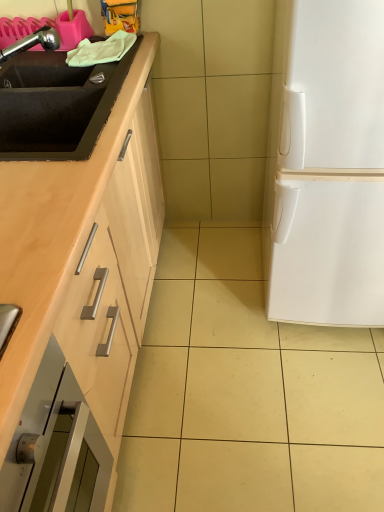
Question: Can you confirm if white matte refrigerator at right is smaller than chrome metallic faucet at upper left, the second sink from the bottom?

Choices:
 (A) yes
 (B) no

Answer: (B)

Question: From the image's perspective, does white matte refrigerator at right appear higher than chrome metallic faucet at upper left, placed as the 1th sink when sorted from top to bottom?

Choices:
 (A) no
 (B) yes

Answer: (A)

Question: Can you confirm if white matte refrigerator at right is thinner than chrome metallic faucet at upper left, the second sink from the bottom?

Choices:
 (A) no
 (B) yes

Answer: (A)

Question: Could you tell me if white matte refrigerator at right is turned towards chrome metallic faucet at upper left, the second sink from the bottom?

Choices:
 (A) no
 (B) yes

Answer: (A)

Question: Does white matte refrigerator at right come behind chrome metallic faucet at upper left, the second sink from the bottom?

Choices:
 (A) yes
 (B) no

Answer: (B)

Question: Does white matte refrigerator at right appear on the left side of chrome metallic faucet at upper left, placed as the 1th sink when sorted from top to bottom?

Choices:
 (A) yes
 (B) no

Answer: (B)

Question: Is black matte sink at left, which appears as the second sink when viewed from the top, at the back of chrome metallic faucet at upper left, placed as the 1th sink when sorted from top to bottom?

Choices:
 (A) no
 (B) yes

Answer: (A)

Question: From a real-world perspective, does chrome metallic faucet at upper left, placed as the 1th sink when sorted from top to bottom, stand above black matte sink at left, which appears as the second sink when viewed from the top?

Choices:
 (A) yes
 (B) no

Answer: (A)

Question: Could you tell me if chrome metallic faucet at upper left, the second sink from the bottom, is turned towards black matte sink at left, which appears as the second sink when viewed from the top?

Choices:
 (A) no
 (B) yes

Answer: (A)

Question: Is chrome metallic faucet at upper left, the second sink from the bottom, positioned far away from black matte sink at left, which appears as the second sink when viewed from the top?

Choices:
 (A) no
 (B) yes

Answer: (A)

Question: Is chrome metallic faucet at upper left, the second sink from the bottom, not inside black matte sink at left, which appears as the second sink when viewed from the top?

Choices:
 (A) no
 (B) yes

Answer: (B)

Question: Does chrome metallic faucet at upper left, the second sink from the bottom, have a lesser width compared to black matte sink at left, the 1th sink when ordered from bottom to top?

Choices:
 (A) no
 (B) yes

Answer: (B)

Question: Considering the relative sizes of white matte refrigerator at right and black matte sink at left, which appears as the second sink when viewed from the top, in the image provided, is white matte refrigerator at right smaller than black matte sink at left, which appears as the second sink when viewed from the top,?

Choices:
 (A) yes
 (B) no

Answer: (B)